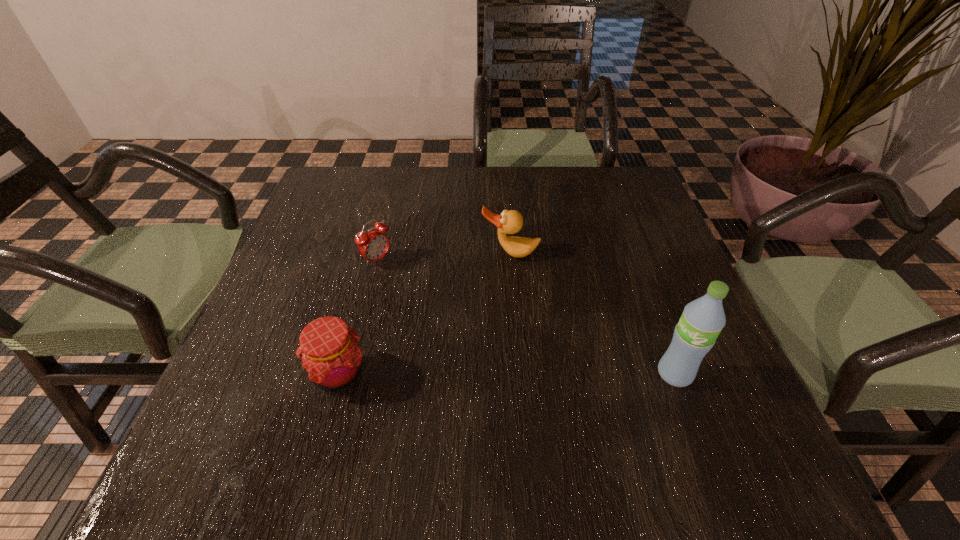
Locate an element on the screen. vacant spot on the desktop that is between the jam and the tallest object and is positioned on the beak of the third object from left to right is located at coordinates (493, 373).

Where is `free spot on the desktop that is between the jam and the rightmost object and is positioned on the face of the alarm clock`? The height and width of the screenshot is (540, 960). free spot on the desktop that is between the jam and the rightmost object and is positioned on the face of the alarm clock is located at coordinates (538, 374).